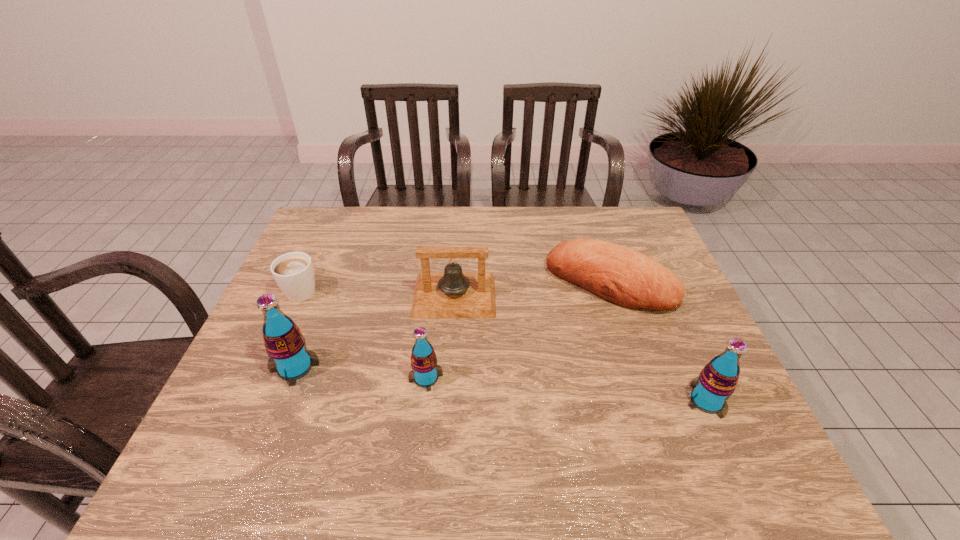
In order to click on the leftmost soda in this screenshot , I will do coord(285,344).

At what (x,y) coordinates should I click in order to perform the action: click on the shortest soda. Please return your answer as a coordinate pair (x, y). Looking at the image, I should click on (425, 372).

Locate an element on the screen. Image resolution: width=960 pixels, height=540 pixels. the rightmost soda is located at coordinates tap(717, 381).

Locate an element on the screen. This screenshot has width=960, height=540. the second tallest object is located at coordinates (717, 381).

Identify the location of bell. (452, 294).

You are a GUI agent. You are given a task and a screenshot of the screen. Output one action in this format:
    pyautogui.click(x=<x>, y=<y>)
    Task: Click on the cappuccino
    This screenshot has height=540, width=960.
    Given the screenshot: What is the action you would take?
    pyautogui.click(x=293, y=272)

The height and width of the screenshot is (540, 960). Find the location of `bread`. bread is located at coordinates (620, 275).

In order to click on free space located 0.240m on the back of the leftmost soda in this screenshot , I will do `click(327, 285)`.

Find the location of `vacant region located 0.370m on the left of the second soda from right to left`. vacant region located 0.370m on the left of the second soda from right to left is located at coordinates (253, 377).

You are a GUI agent. You are given a task and a screenshot of the screen. Output one action in this format:
    pyautogui.click(x=<x>, y=<y>)
    Task: Click on the vacant region located on the back of the second tallest object
    This screenshot has width=960, height=540.
    Given the screenshot: What is the action you would take?
    pyautogui.click(x=655, y=284)